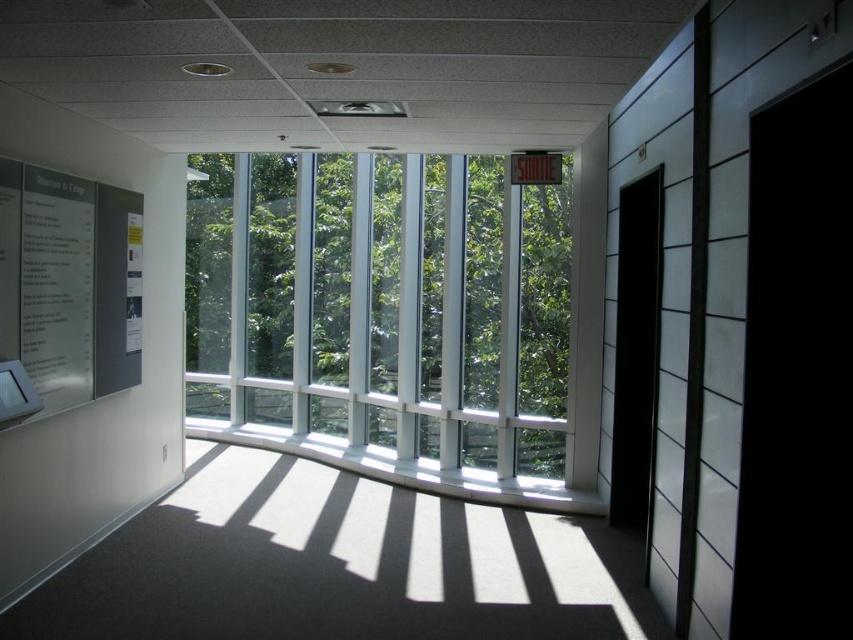
You are standing in the office and want to find the exit. You see a point at coordinates (383, 304). Is this point on the transparent glass window at center or on the wall with the SORTIE sign?

The point at coordinates (383, 304) is on the transparent glass window at center according to the description.

You are standing in the office and need to hang a new notice that is 12 inches wide. The notice must be placed between the matte gray bulletin board at left and the white glossy poster at left. Can the notice fit in the available space between them?

The distance between the matte gray bulletin board at left and the white glossy poster at left is 14.04 inches, so yes, the 12 inch wide notice can fit in the space between them.